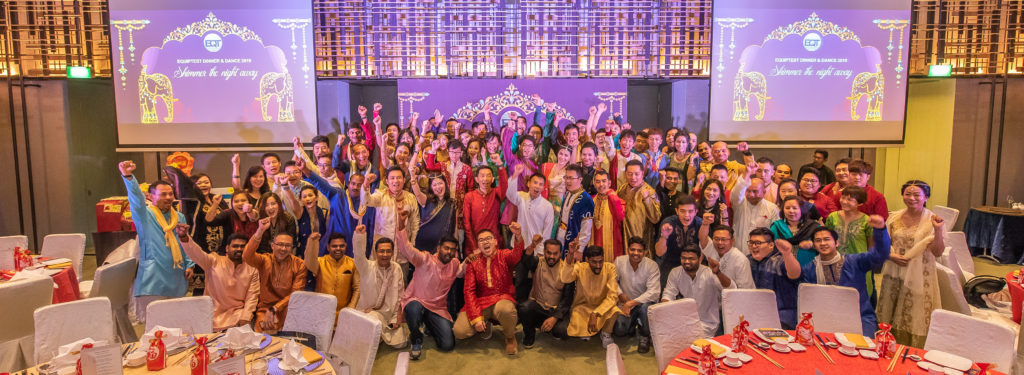
Locate an element on the screen. plates is located at coordinates (709, 351), (775, 337), (855, 338), (954, 368), (247, 334), (158, 330), (83, 345), (294, 356).